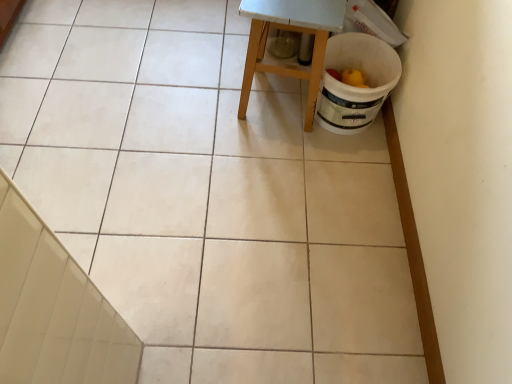
You are a GUI agent. You are given a task and a screenshot of the screen. Output one action in this format:
    pyautogui.click(x=<x>, y=<y>)
    Task: Click on the free point below wooden stool at center (from a real-world perspective)
    The height and width of the screenshot is (384, 512).
    Given the screenshot: What is the action you would take?
    coord(272,93)